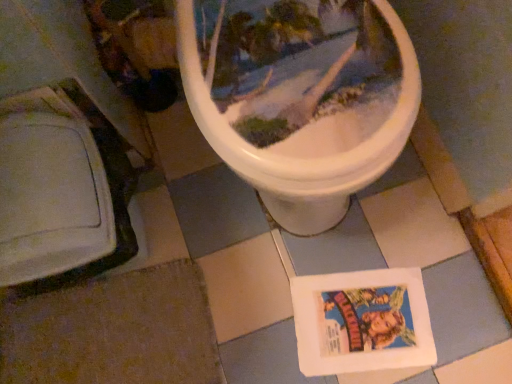
You are a GUI agent. You are given a task and a screenshot of the screen. Output one action in this format:
    pyautogui.click(x=<x>, y=<y>)
    Task: Click on the vacant space behind white paper comic book at lower center
    
    Given the screenshot: What is the action you would take?
    pyautogui.click(x=342, y=232)